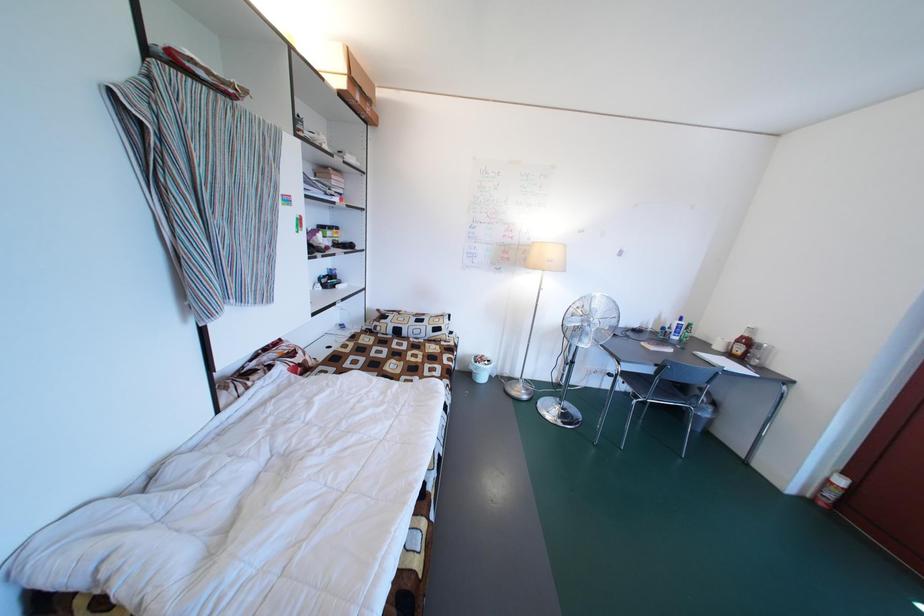
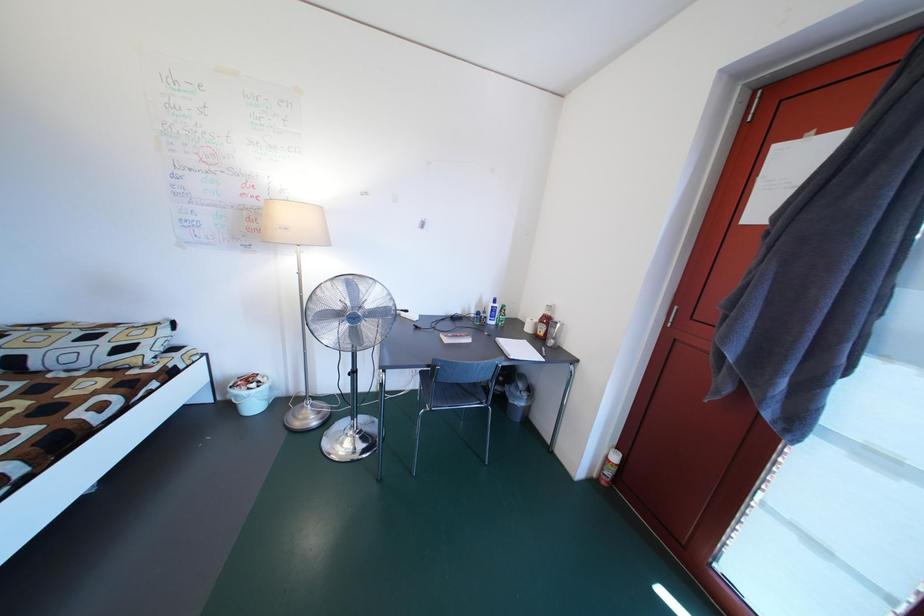
Looking at this image, in a continuous first-person perspective shot, in which direction is the camera moving?

The cameraman moved toward right, forward.